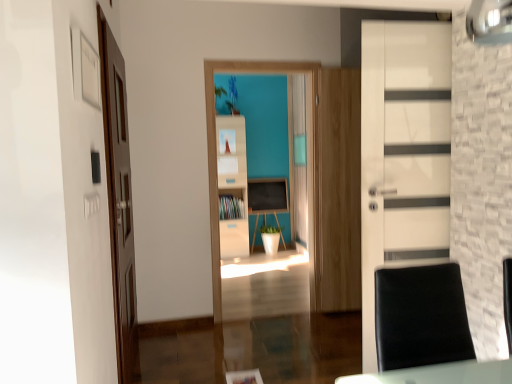
Question: Does matte wood cabinet at center contain white wood bookshelf at center?

Choices:
 (A) yes
 (B) no

Answer: (B)

Question: From the image's perspective, does matte wood cabinet at center appear lower than white wood bookshelf at center?

Choices:
 (A) no
 (B) yes

Answer: (B)

Question: Is matte wood cabinet at center to the right of white wood bookshelf at center from the viewer's perspective?

Choices:
 (A) yes
 (B) no

Answer: (B)

Question: From the image's perspective, does matte wood cabinet at center appear higher than white wood bookshelf at center?

Choices:
 (A) no
 (B) yes

Answer: (A)

Question: Does matte wood cabinet at center turn towards white wood bookshelf at center?

Choices:
 (A) yes
 (B) no

Answer: (A)

Question: Can you confirm if matte wood cabinet at center is wider than white wood bookshelf at center?

Choices:
 (A) no
 (B) yes

Answer: (A)

Question: Is white matte bookshelf at center placed right next to brown wooden door at left, which ranks as the second door in right-to-left order?

Choices:
 (A) no
 (B) yes

Answer: (A)

Question: Is white matte bookshelf at center facing away from brown wooden door at left, which ranks as the second door in right-to-left order?

Choices:
 (A) yes
 (B) no

Answer: (B)

Question: Can you confirm if white matte bookshelf at center is taller than brown wooden door at left, which is counted as the 1th door, starting from the left?

Choices:
 (A) no
 (B) yes

Answer: (B)

Question: Considering the relative sizes of white matte bookshelf at center and brown wooden door at left, which is counted as the 1th door, starting from the left, in the image provided, is white matte bookshelf at center smaller than brown wooden door at left, which is counted as the 1th door, starting from the left,?

Choices:
 (A) no
 (B) yes

Answer: (B)

Question: Considering the relative sizes of white matte bookshelf at center and brown wooden door at left, which is counted as the 1th door, starting from the left, in the image provided, is white matte bookshelf at center thinner than brown wooden door at left, which is counted as the 1th door, starting from the left,?

Choices:
 (A) yes
 (B) no

Answer: (A)

Question: Does white matte bookshelf at center have a larger size compared to brown wooden door at left, which is counted as the 1th door, starting from the left?

Choices:
 (A) yes
 (B) no

Answer: (B)

Question: Can black leather swivel chair at lower right be found inside matte wood cabinet at center?

Choices:
 (A) yes
 (B) no

Answer: (B)